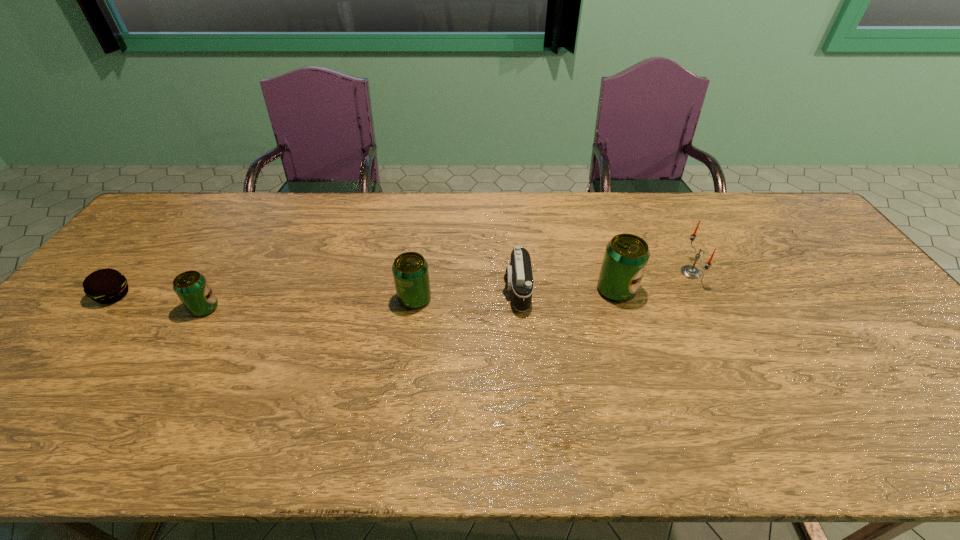
I want to click on the second object from left to right, so click(191, 287).

Where is `the shortest beer can`? This screenshot has width=960, height=540. the shortest beer can is located at coordinates (191, 287).

This screenshot has width=960, height=540. Find the location of `the second beer can from right to left`. the second beer can from right to left is located at coordinates (410, 271).

Locate an element on the screen. the third object from left to right is located at coordinates (410, 271).

This screenshot has height=540, width=960. Identify the location of the second object from right to left. (626, 256).

The image size is (960, 540). What are the coordinates of `the rightmost beer can` in the screenshot? It's located at (626, 256).

Find the location of `patty`. patty is located at coordinates (105, 286).

At what (x,y) coordinates should I click in order to perform the action: click on the leftmost object. Please return your answer as a coordinate pair (x, y). Looking at the image, I should click on (105, 286).

Identify the location of candle. The width and height of the screenshot is (960, 540). (689, 271).

Image resolution: width=960 pixels, height=540 pixels. What are the coordinates of `camera` in the screenshot? It's located at (518, 278).